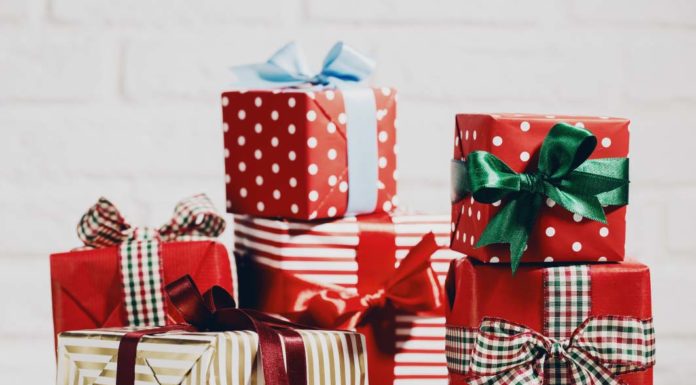
At what (x,y) coordinates should I click in order to perform the action: click on wrapped gifts. Please return your answer as a coordinate pair (x, y). This screenshot has width=696, height=385. Looking at the image, I should click on (209, 359), (149, 291), (349, 264), (301, 174), (520, 212), (578, 318).